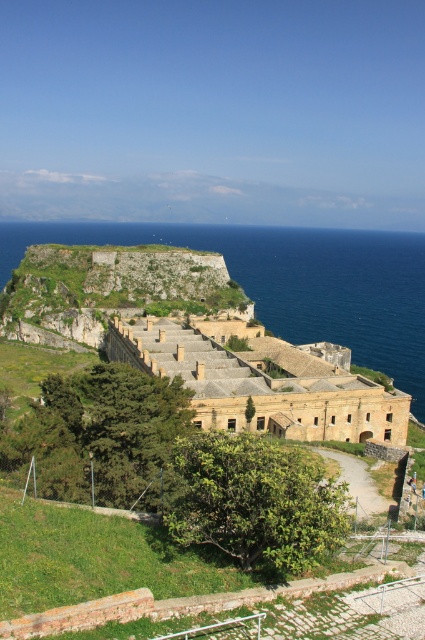
Consider the image. Which is more to the left, blue water at center or green mossy stone wall at center?

green mossy stone wall at center is more to the left.

In the scene shown: Does blue water at center have a lesser height compared to green mossy stone wall at center?

No.

The height and width of the screenshot is (640, 425). I want to click on blue water at center, so click(294, 282).

Does point (362, 403) lie behind point (90, 288)?

That is False.

Between beige stone building at center and green mossy stone wall at center, which one appears on the left side from the viewer's perspective?

green mossy stone wall at center

Identify the location of beige stone building at center. click(261, 385).

Who is lower down, blue water at center or beige stone building at center?

beige stone building at center is lower down.

Between blue water at center and beige stone building at center, which one appears on the right side from the viewer's perspective?

beige stone building at center is more to the right.

Find the location of a particular element. blue water at center is located at coordinates (294, 282).